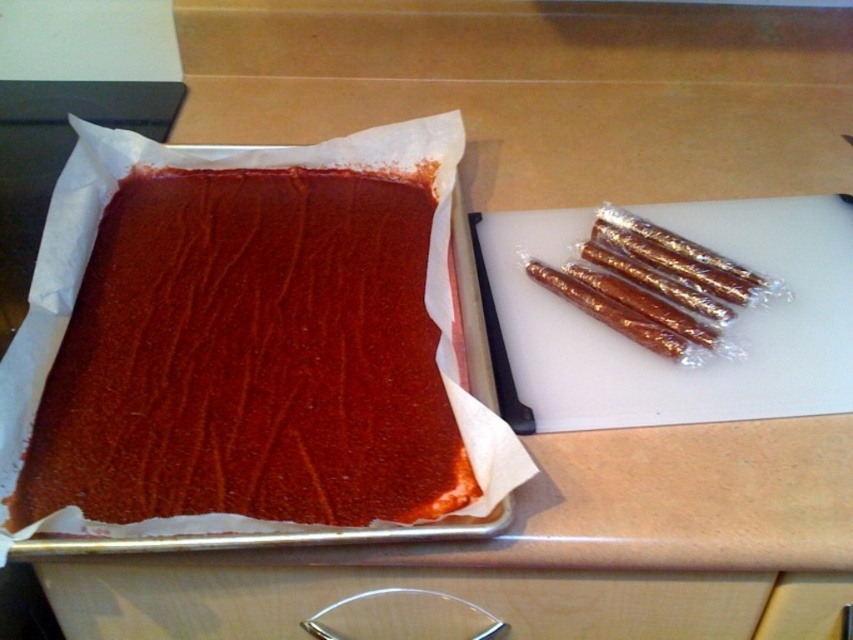
Does smooth chocolate cake at center have a greater width compared to wooden drawer handle at lower center?

Incorrect, smooth chocolate cake at center's width does not surpass wooden drawer handle at lower center's.

Between smooth chocolate cake at center and wooden drawer handle at lower center, which one has more height?

With more height is smooth chocolate cake at center.

Which is behind, point (315, 323) or point (344, 579)?

The point (315, 323) is more distant.

Identify the location of smooth chocolate cake at center. The image size is (853, 640). (248, 356).

Looking at this image, does wooden drawer handle at lower center have a lesser width compared to translucent plastic sticks at right?

Incorrect, wooden drawer handle at lower center's width is not less than translucent plastic sticks at right's.

Is wooden drawer handle at lower center positioned at the back of translucent plastic sticks at right?

No, wooden drawer handle at lower center is closer to the viewer.

Find the location of a particular element. wooden drawer handle at lower center is located at coordinates (384, 586).

Measure the distance between point (288, 472) and camera.

A distance of 23.52 inches exists between point (288, 472) and camera.

Find the location of a particular element. Image resolution: width=853 pixels, height=640 pixels. smooth chocolate cake at center is located at coordinates (248, 356).